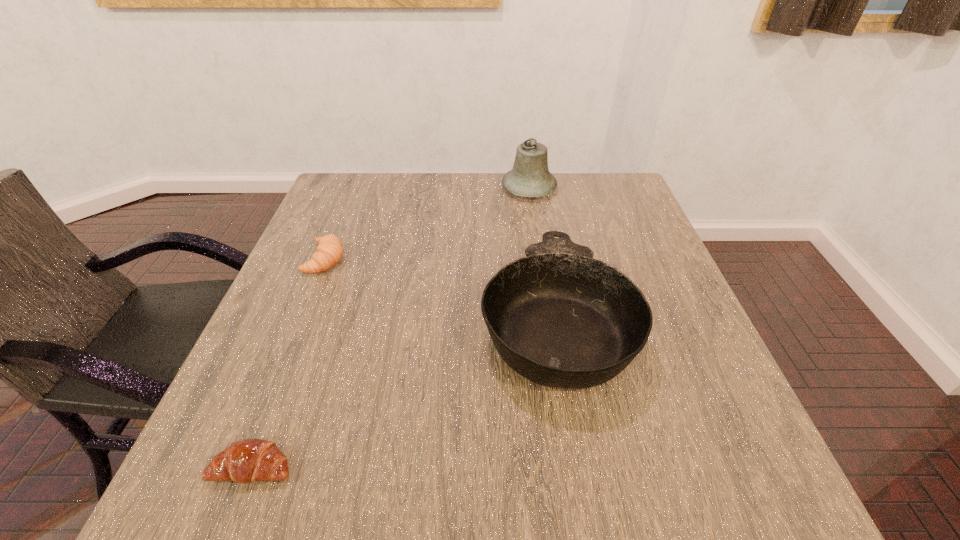
The height and width of the screenshot is (540, 960). Identify the location of vacant area located on the back of the farther crescent roll. click(356, 184).

This screenshot has height=540, width=960. In order to click on free space located on the right of the nearer crescent roll in this screenshot , I will do `click(482, 466)`.

Locate an element on the screen. object that is at the far edge is located at coordinates (530, 177).

Where is `object positioned at the near edge`? This screenshot has width=960, height=540. object positioned at the near edge is located at coordinates (245, 461).

This screenshot has width=960, height=540. Identify the location of object that is positioned at the right edge. (560, 318).

Image resolution: width=960 pixels, height=540 pixels. Find the location of `object at the near left corner`. object at the near left corner is located at coordinates (245, 461).

Identify the location of free space at the far edge of the desktop. (407, 196).

Where is `free space at the near edge`? free space at the near edge is located at coordinates (533, 456).

The width and height of the screenshot is (960, 540). What are the coordinates of `free spot at the left edge of the desktop` in the screenshot? It's located at (370, 218).

At what (x,y) coordinates should I click in order to perform the action: click on vacant space at the right edge of the desktop. Please return your answer as a coordinate pair (x, y). The height and width of the screenshot is (540, 960). Looking at the image, I should click on (679, 339).